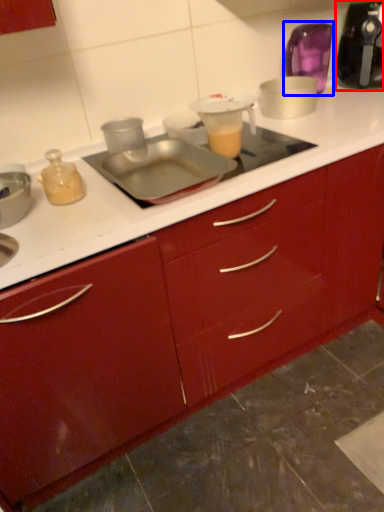
Question: Which of the following is the closest to the observer, kitchen appliance (highlighted by a red box) or appliance (highlighted by a blue box)?

Choices:
 (A) kitchen appliance
 (B) appliance

Answer: (A)